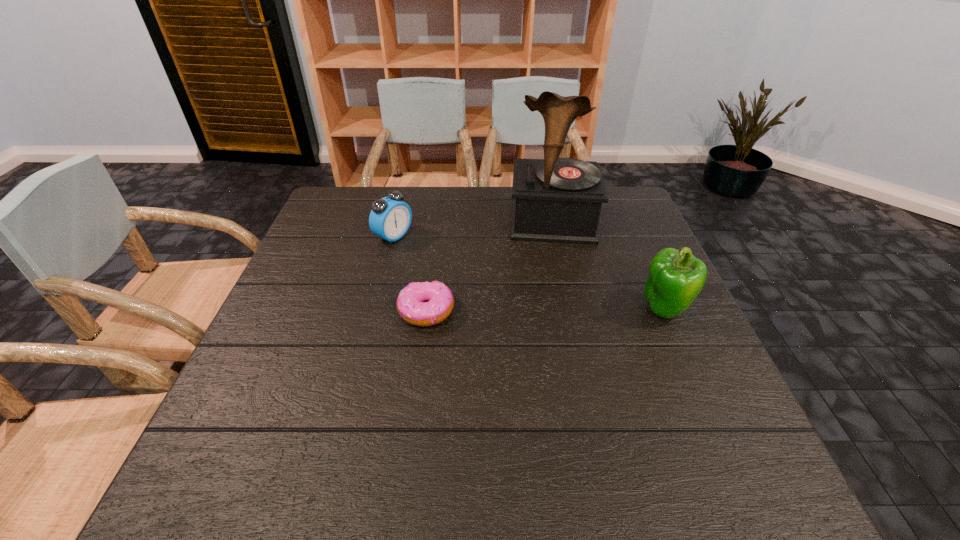
Where is `blank space at the near edge of the desktop`? The height and width of the screenshot is (540, 960). blank space at the near edge of the desktop is located at coordinates (543, 409).

You are a GUI agent. You are given a task and a screenshot of the screen. Output one action in this format:
    pyautogui.click(x=<x>, y=<y>)
    Task: Click on the free spot at the left edge of the desktop
    The height and width of the screenshot is (540, 960).
    Given the screenshot: What is the action you would take?
    pyautogui.click(x=298, y=256)

You are a GUI agent. You are given a task and a screenshot of the screen. Output one action in this format:
    pyautogui.click(x=<x>, y=<y>)
    Task: Click on the vacant space at the right edge of the desktop
    This screenshot has width=960, height=540.
    Given the screenshot: What is the action you would take?
    pyautogui.click(x=684, y=363)

Locate an element on the screen. The height and width of the screenshot is (540, 960). vacant space at the far left corner is located at coordinates (374, 189).

Find the location of a particular element. vacant space at the near left corner is located at coordinates (285, 409).

Identify the location of blank area at the far right corner. Image resolution: width=960 pixels, height=540 pixels. (631, 201).

Identify the location of free space between the rightmost object and the shortest object. (545, 310).

Locate an element on the screen. vacant region between the alarm clock and the shortest object is located at coordinates (410, 274).

Identify the location of vacant space in between the second tallest object and the doughnut. This screenshot has height=540, width=960. (545, 310).

At what (x,y) coordinates should I click in order to perform the action: click on vacant region between the third shortest object and the tallest object. Please return your answer as a coordinate pair (x, y). Looking at the image, I should click on (609, 265).